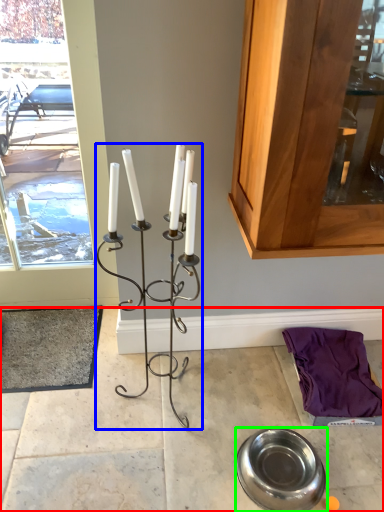
Question: Which is nearer to the concrete (highlighted by a red box)? candle holder (highlighted by a blue box) or tableware (highlighted by a green box).

Choices:
 (A) candle holder
 (B) tableware

Answer: (B)